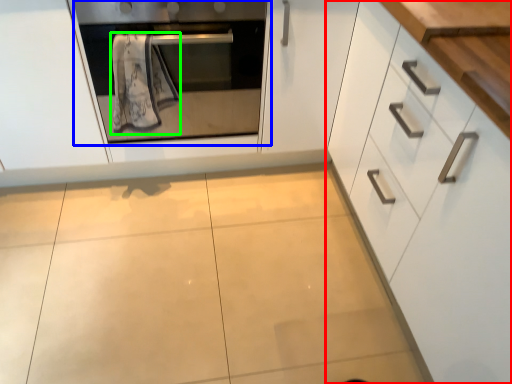
Question: Considering the real-world distances, which object is closest to cabinetry (highlighted by a red box)? oven (highlighted by a blue box) or bath towel (highlighted by a green box).

Choices:
 (A) oven
 (B) bath towel

Answer: (A)